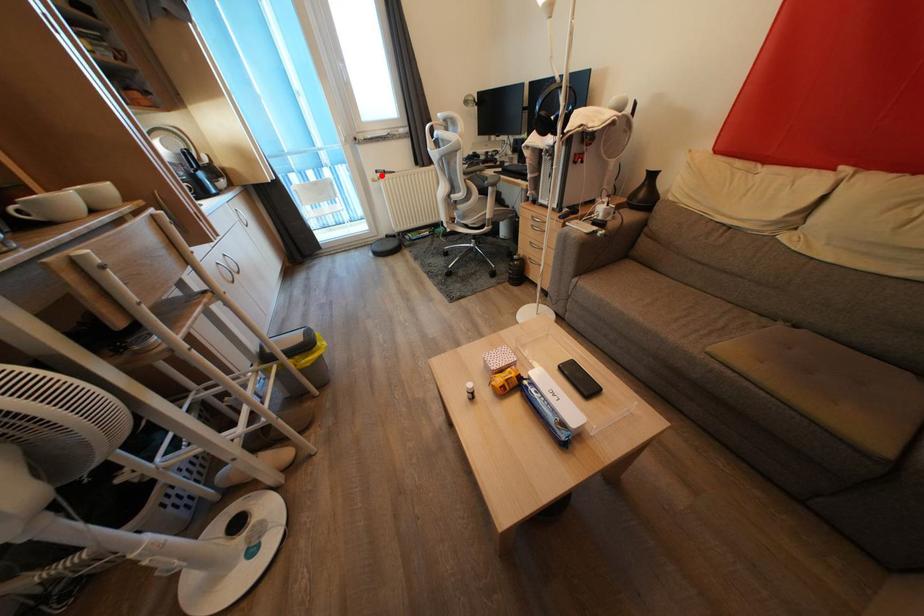
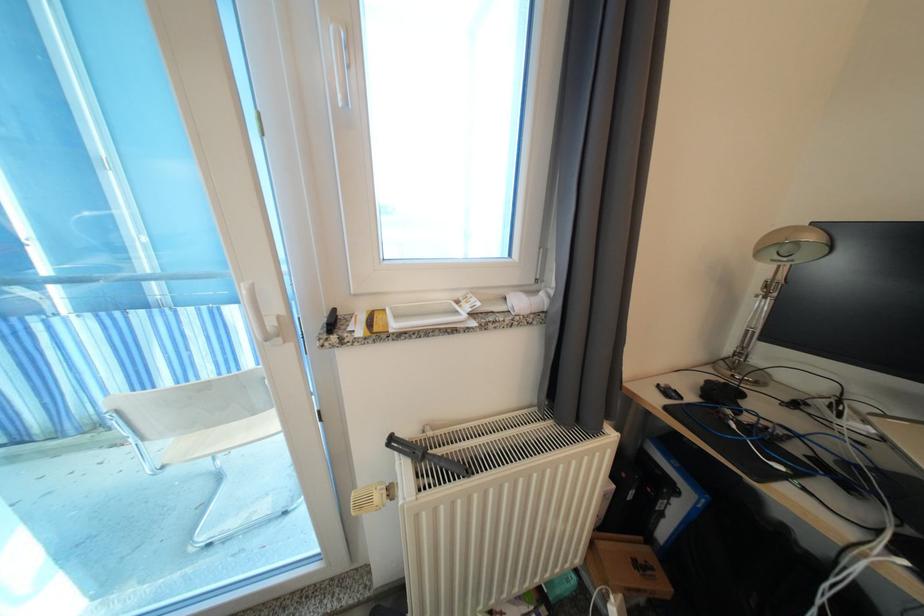
Locate, in the second image, the point that corresponds to the highlighted location in the first image.

(395, 445)